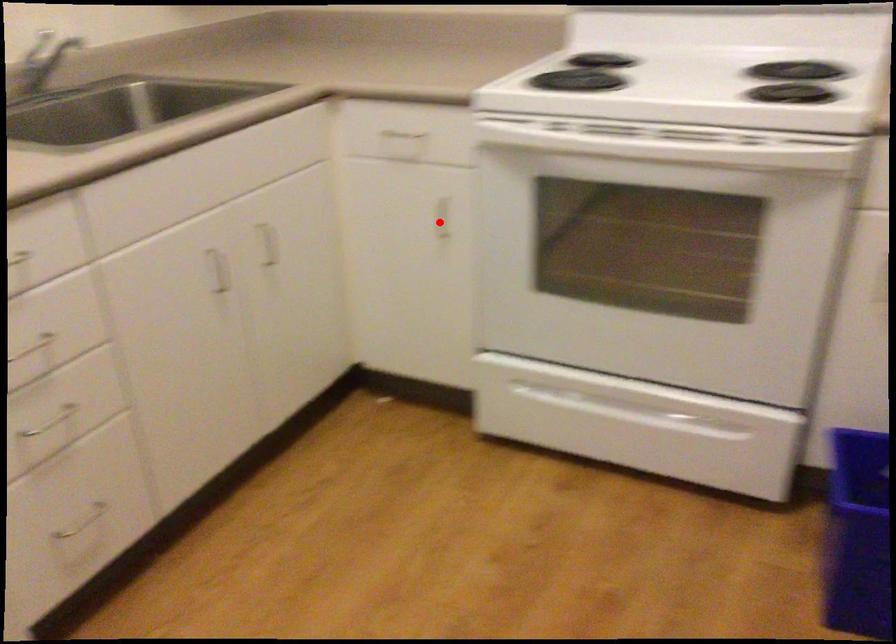
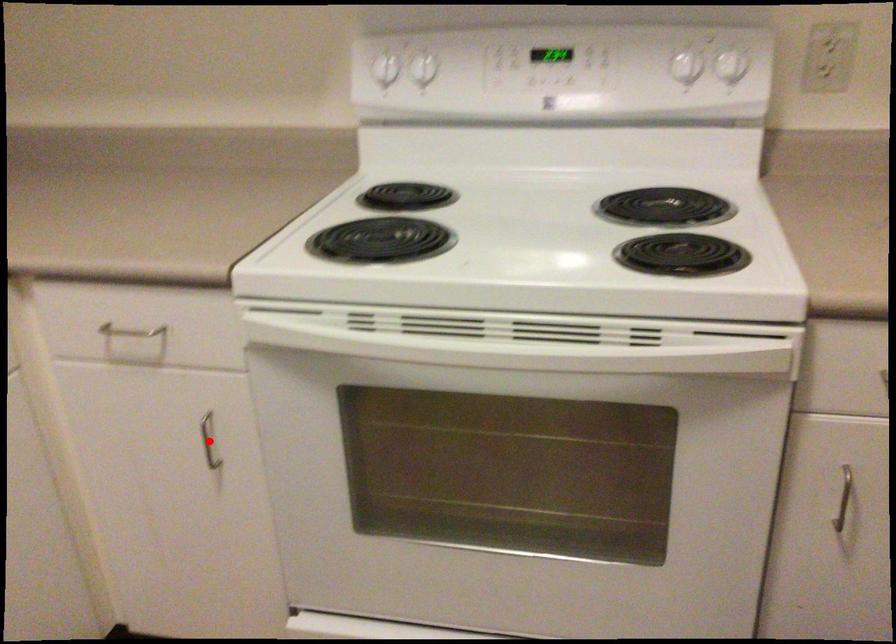
I am providing you with two images of the same scene from different viewpoints. A red point is marked on the first image and another point is marked on the second image. Do the highlighted points in image1 and image2 indicate the same real-world spot?

Yes